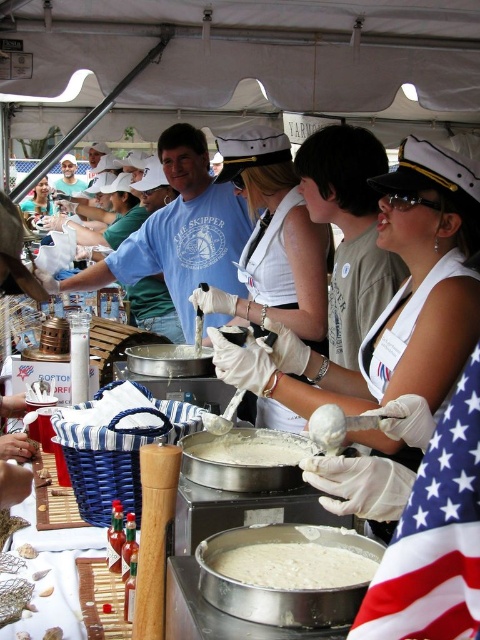
What do you see at coordinates (295, 564) in the screenshot?
I see `white creamy batter at center` at bounding box center [295, 564].

Between point (286, 586) and point (295, 460), which one is positioned behind?

Positioned behind is point (295, 460).

Image resolution: width=480 pixels, height=640 pixels. Find the location of `white creamy batter at center`. white creamy batter at center is located at coordinates (295, 564).

Based on the photo, is white matte gloves at center above white creamy substance at center?

Indeed, white matte gloves at center is positioned over white creamy substance at center.

Is point (283, 240) positioned before point (261, 452)?

No, it is not.

Between point (267, 134) and point (269, 465), which one is positioned behind?

The point (267, 134) is behind.

I want to click on white matte gloves at center, so click(x=274, y=241).

Between white creamy substance at center and matte white sailor hat at upper center, which one appears on the left side from the viewer's perspective?

From the viewer's perspective, matte white sailor hat at upper center appears more on the left side.

Does point (183, 451) come farther from viewer compared to point (39, 202)?

No, (183, 451) is closer to viewer.

I want to click on white creamy substance at center, so click(252, 448).